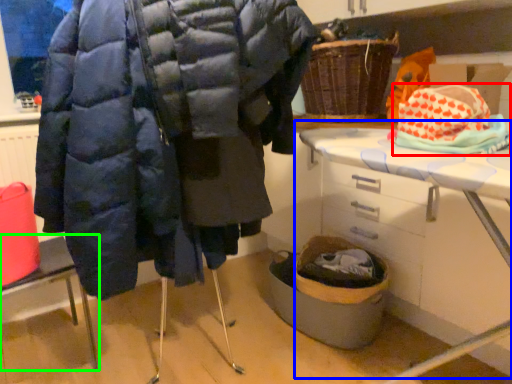
Question: Considering the real-world distances, which object is closest to material (highlighted by a red box)? table (highlighted by a blue box) or furniture (highlighted by a green box).

Choices:
 (A) table
 (B) furniture

Answer: (A)